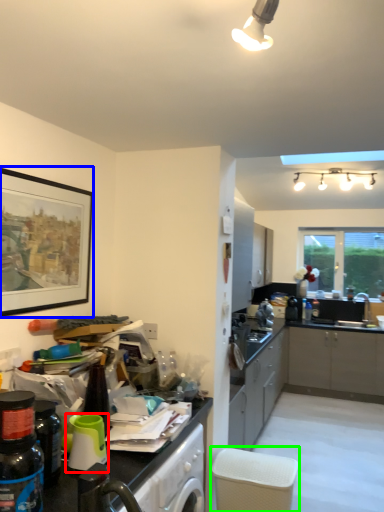
Question: Considering the real-world distances, which object is closest to appliance (highlighted by a red box)? picture frame (highlighted by a blue box) or chair (highlighted by a green box).

Choices:
 (A) picture frame
 (B) chair

Answer: (A)